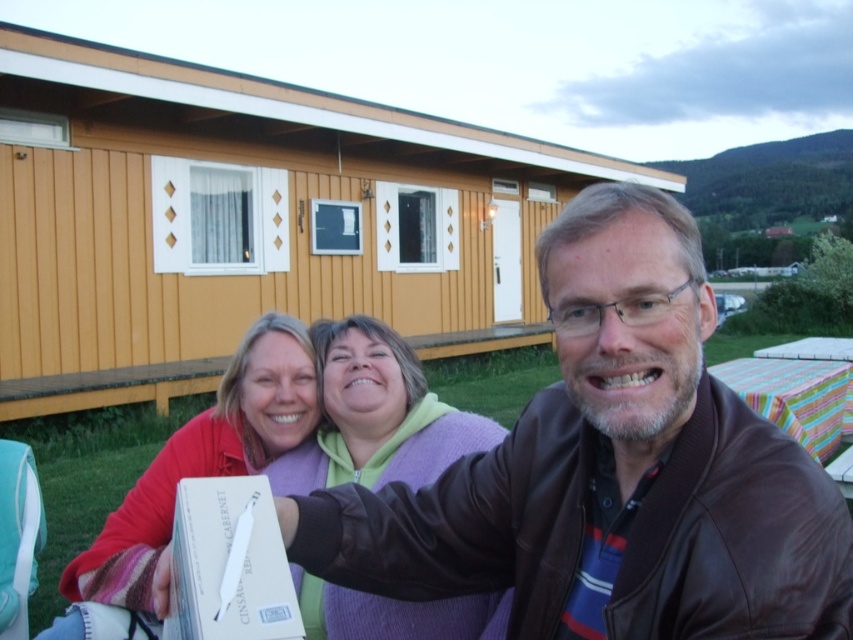
Question: Estimate the real-world distances between objects in this image. Which object is closer to the purple fleece sweater at center?

Choices:
 (A) striped fabric picnic table at right
 (B) yellow wood cabin at center
 (C) brown leather jacket at center
 (D) matte red sweater at center

Answer: (D)

Question: Which object is the closest to the matte red sweater at center?

Choices:
 (A) striped fabric picnic table at right
 (B) yellow wood cabin at center
 (C) brown leather jacket at center
 (D) purple fleece sweater at center

Answer: (D)

Question: Does yellow wood cabin at center lie behind matte red sweater at center?

Choices:
 (A) yes
 (B) no

Answer: (A)

Question: Which of the following is the farthest from the observer?

Choices:
 (A) striped fabric picnic table at right
 (B) purple fleece sweater at center

Answer: (A)

Question: Can you confirm if purple fleece sweater at center is thinner than matte red sweater at center?

Choices:
 (A) yes
 (B) no

Answer: (A)

Question: Does brown leather jacket at center appear on the left side of purple fleece sweater at center?

Choices:
 (A) no
 (B) yes

Answer: (A)